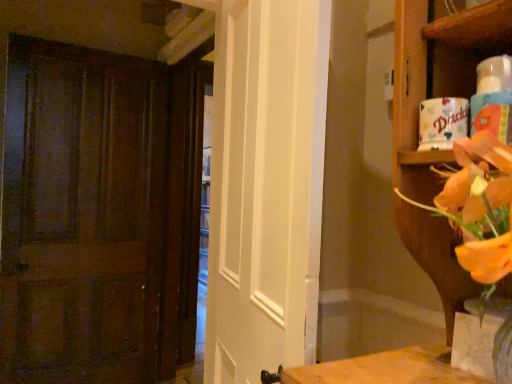
Question: From the image's perspective, is white glossy door at center over wooden door at left?

Choices:
 (A) no
 (B) yes

Answer: (B)

Question: Is white glossy door at center touching wooden door at left?

Choices:
 (A) yes
 (B) no

Answer: (B)

Question: Is white glossy door at center oriented towards wooden door at left?

Choices:
 (A) yes
 (B) no

Answer: (B)

Question: Can you confirm if white glossy door at center is taller than wooden door at left?

Choices:
 (A) yes
 (B) no

Answer: (B)

Question: Considering the relative positions of white glossy door at center and wooden door at left in the image provided, is white glossy door at center to the left of wooden door at left from the viewer's perspective?

Choices:
 (A) no
 (B) yes

Answer: (A)

Question: Is white glossy door at center inside the boundaries of wooden shelf at upper right, or outside?

Choices:
 (A) outside
 (B) inside

Answer: (A)

Question: From a real-world perspective, is white glossy door at center above or below wooden shelf at upper right?

Choices:
 (A) below
 (B) above

Answer: (A)

Question: Based on their positions, is white glossy door at center located to the left or right of wooden shelf at upper right?

Choices:
 (A) left
 (B) right

Answer: (A)

Question: Is white glossy door at center wider or thinner than wooden shelf at upper right?

Choices:
 (A) wide
 (B) thin

Answer: (B)

Question: Considering the relative positions of translucent glass vase at lower right and white glossy door at center in the image provided, is translucent glass vase at lower right to the left or to the right of white glossy door at center?

Choices:
 (A) left
 (B) right

Answer: (B)

Question: From the image's perspective, is translucent glass vase at lower right above or below white glossy door at center?

Choices:
 (A) above
 (B) below

Answer: (B)

Question: From a real-world perspective, relative to white glossy door at center, is translucent glass vase at lower right vertically above or below?

Choices:
 (A) above
 (B) below

Answer: (B)

Question: Considering the positions of translucent glass vase at lower right and white glossy door at center in the image, is translucent glass vase at lower right taller or shorter than white glossy door at center?

Choices:
 (A) tall
 (B) short

Answer: (B)

Question: In terms of size, does wooden door at left appear bigger or smaller than wooden shelf at upper right?

Choices:
 (A) big
 (B) small

Answer: (A)

Question: Relative to wooden shelf at upper right, is wooden door at left in front or behind?

Choices:
 (A) behind
 (B) front

Answer: (A)